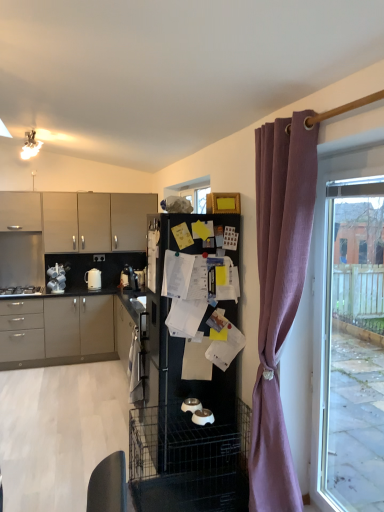
What are the coordinates of `free space to the left of white glossy pet bowls at center, acting as the first appliance starting from the right` in the screenshot? It's located at (175, 426).